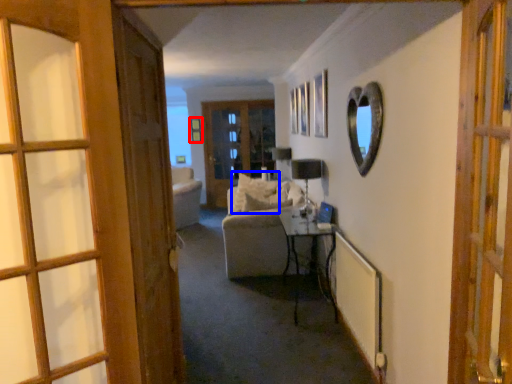
Question: Which point is closer to the camera, picture frame (highlighted by a red box) or pillow (highlighted by a blue box)?

Choices:
 (A) picture frame
 (B) pillow

Answer: (B)